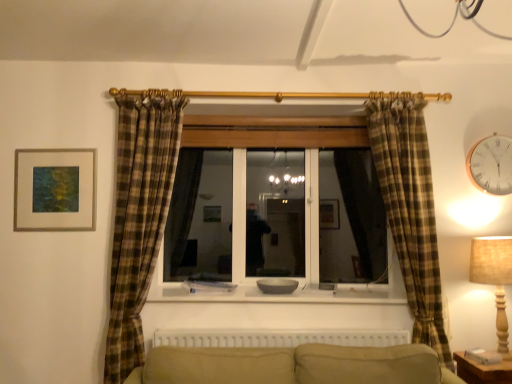
Question: Can you confirm if beige fabric lampshade at right is positioned to the right of white plastic radiator at lower center?

Choices:
 (A) yes
 (B) no

Answer: (A)

Question: Are beige fabric lampshade at right and white plastic radiator at lower center located far from each other?

Choices:
 (A) no
 (B) yes

Answer: (A)

Question: Is the depth of beige fabric lampshade at right less than that of white plastic radiator at lower center?

Choices:
 (A) yes
 (B) no

Answer: (A)

Question: Is beige fabric lampshade at right positioned with its back to white plastic radiator at lower center?

Choices:
 (A) no
 (B) yes

Answer: (A)

Question: From a real-world perspective, does beige fabric lampshade at right sit lower than white plastic radiator at lower center?

Choices:
 (A) yes
 (B) no

Answer: (B)

Question: Does beige fabric lampshade at right have a smaller size compared to white plastic radiator at lower center?

Choices:
 (A) no
 (B) yes

Answer: (A)

Question: Could you tell me if gold metallic clock at upper right is facing smooth white window sill at center?

Choices:
 (A) yes
 (B) no

Answer: (B)

Question: Does gold metallic clock at upper right have a smaller size compared to smooth white window sill at center?

Choices:
 (A) no
 (B) yes

Answer: (B)

Question: From a real-world perspective, is gold metallic clock at upper right over smooth white window sill at center?

Choices:
 (A) no
 (B) yes

Answer: (B)

Question: From a real-world perspective, is gold metallic clock at upper right beneath smooth white window sill at center?

Choices:
 (A) no
 (B) yes

Answer: (A)

Question: From the image's perspective, is gold metallic clock at upper right above smooth white window sill at center?

Choices:
 (A) no
 (B) yes

Answer: (B)

Question: Is gold metallic clock at upper right to the right of smooth white window sill at center from the viewer's perspective?

Choices:
 (A) yes
 (B) no

Answer: (A)

Question: Considering the relative sizes of matte gold picture frame at upper left and gold metallic clock at upper right in the image provided, is matte gold picture frame at upper left shorter than gold metallic clock at upper right?

Choices:
 (A) yes
 (B) no

Answer: (B)